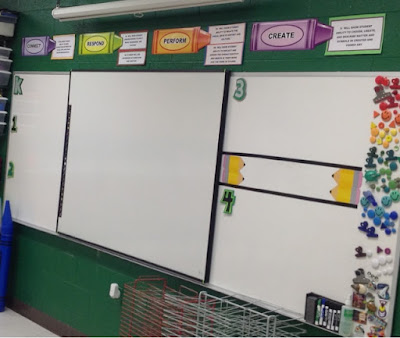
I want to click on plastic container, so click(x=2, y=126), click(x=3, y=115), click(x=4, y=103), click(x=4, y=81), click(x=5, y=64), click(x=5, y=53), click(x=8, y=24).